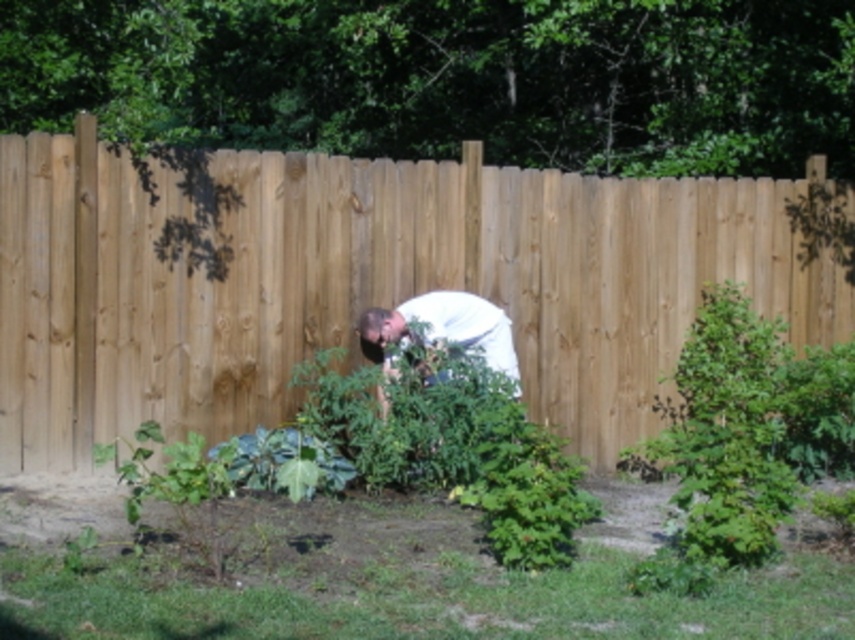
Question: Is natural wood fence at center to the left of white matte shirt at center from the viewer's perspective?

Choices:
 (A) yes
 (B) no

Answer: (A)

Question: Is natural wood fence at center bigger than white matte shirt at center?

Choices:
 (A) no
 (B) yes

Answer: (B)

Question: Among these objects, which one is farthest from the camera?

Choices:
 (A) natural wood fence at center
 (B) white matte shirt at center

Answer: (A)

Question: Can you confirm if natural wood fence at center is wider than white matte shirt at center?

Choices:
 (A) no
 (B) yes

Answer: (B)

Question: Among these objects, which one is farthest from the camera?

Choices:
 (A) natural wood fence at center
 (B) white matte shirt at center

Answer: (A)